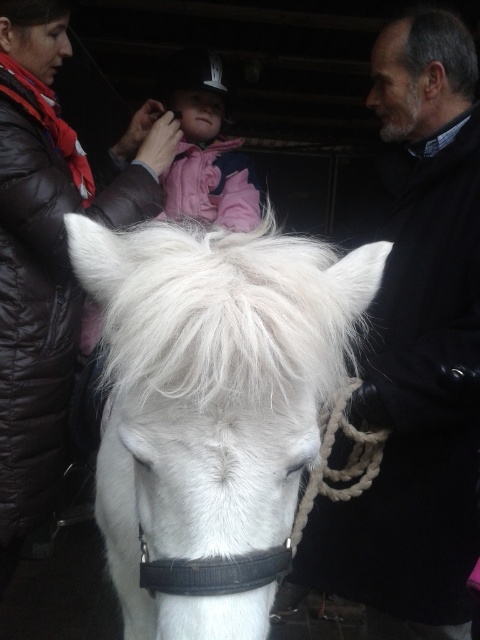
Does white fluffy horse at center appear over pink fleece jacket at center?

Incorrect, white fluffy horse at center is not positioned above pink fleece jacket at center.

Which is in front, point (252, 499) or point (197, 214)?

Point (252, 499) is in front.

What do you see at coordinates (212, 397) in the screenshot? This screenshot has width=480, height=640. I see `white fluffy horse at center` at bounding box center [212, 397].

Where is `white fluffy horse at center`? This screenshot has height=640, width=480. white fluffy horse at center is located at coordinates (212, 397).

Does point (224, 472) come farther from viewer compared to point (436, 269)?

No, (224, 472) is in front of (436, 269).

Between point (260, 508) and point (348, 566), which one is positioned in front?

Point (260, 508)

What are the coordinates of `white fluffy horse at center` in the screenshot? It's located at point(212,397).

Consider the image. Which is more to the left, brown leather jacket at left or pink fleece jacket at center?

brown leather jacket at left is more to the left.

Does point (68, 147) come behind point (166, 97)?

That is False.

You are a GUI agent. You are given a task and a screenshot of the screen. Output one action in this format:
    pyautogui.click(x=<x>, y=<y>)
    Task: Click on the brown leather jacket at left
    The image size is (480, 640).
    Given the screenshot: What is the action you would take?
    pyautogui.click(x=49, y=252)